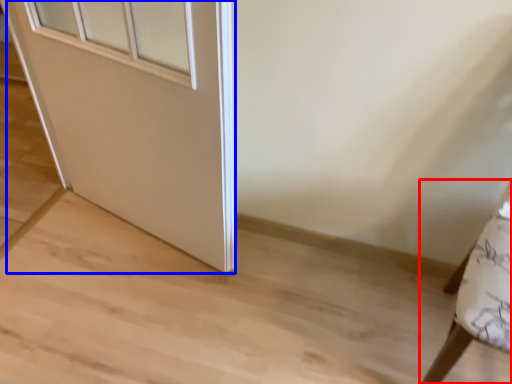
Question: Which of the following is the farthest to the observer, furniture (highlighted by a red box) or door (highlighted by a blue box)?

Choices:
 (A) furniture
 (B) door

Answer: (B)